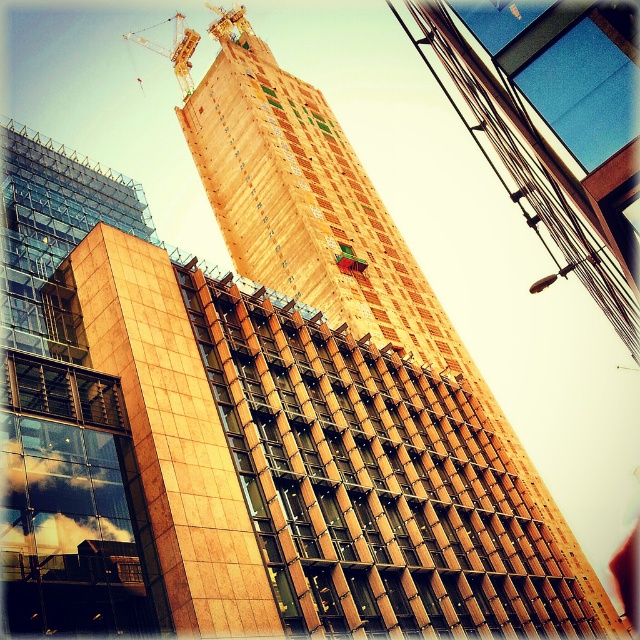
Question: Is brown textured building at center above metallic yellow crane at upper left?

Choices:
 (A) yes
 (B) no

Answer: (B)

Question: Which point is closer to the camera?

Choices:
 (A) (516, 474)
 (B) (182, 51)

Answer: (A)

Question: Is brown textured building at center smaller than metallic yellow crane at upper left?

Choices:
 (A) yes
 (B) no

Answer: (A)

Question: Can you confirm if brown textured building at center is bigger than metallic yellow crane at upper left?

Choices:
 (A) yes
 (B) no

Answer: (B)